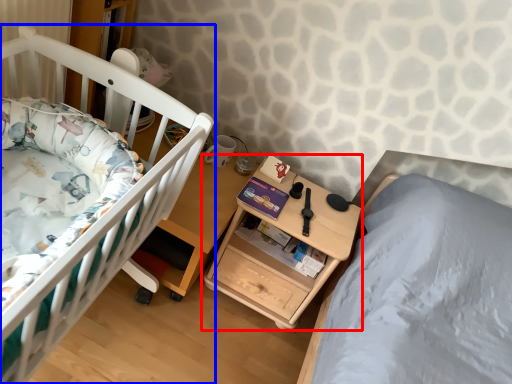
Question: Which point is further to the camera, nightstand (highlighted by a red box) or infant bed (highlighted by a blue box)?

Choices:
 (A) nightstand
 (B) infant bed

Answer: (A)